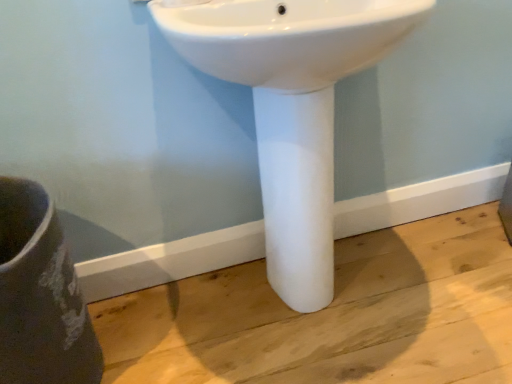
Question: Considering the relative positions of white glossy sink at center and matte gray vase at lower left in the image provided, is white glossy sink at center to the right of matte gray vase at lower left from the viewer's perspective?

Choices:
 (A) no
 (B) yes

Answer: (B)

Question: From a real-world perspective, is white glossy sink at center below matte gray vase at lower left?

Choices:
 (A) no
 (B) yes

Answer: (A)

Question: Is white glossy sink at center smaller than matte gray vase at lower left?

Choices:
 (A) no
 (B) yes

Answer: (A)

Question: Is matte gray vase at lower left inside white glossy sink at center?

Choices:
 (A) yes
 (B) no

Answer: (B)

Question: From the image's perspective, is white glossy sink at center located above matte gray vase at lower left?

Choices:
 (A) yes
 (B) no

Answer: (A)

Question: From the image's perspective, is white glossy sink at center under matte gray vase at lower left?

Choices:
 (A) no
 (B) yes

Answer: (A)

Question: Is white glossy sink at center located within matte gray vase at lower left?

Choices:
 (A) yes
 (B) no

Answer: (B)

Question: Is matte gray vase at lower left further to the viewer compared to white glossy sink at center?

Choices:
 (A) no
 (B) yes

Answer: (B)

Question: From a real-world perspective, is matte gray vase at lower left under white glossy sink at center?

Choices:
 (A) yes
 (B) no

Answer: (A)

Question: Does matte gray vase at lower left have a greater width compared to white glossy sink at center?

Choices:
 (A) yes
 (B) no

Answer: (A)

Question: From the image's perspective, is matte gray vase at lower left over white glossy sink at center?

Choices:
 (A) yes
 (B) no

Answer: (B)

Question: Is matte gray vase at lower left facing towards white glossy sink at center?

Choices:
 (A) no
 (B) yes

Answer: (A)

Question: Is matte gray vase at lower left in front of or behind white glossy sink at center in the image?

Choices:
 (A) behind
 (B) front

Answer: (A)